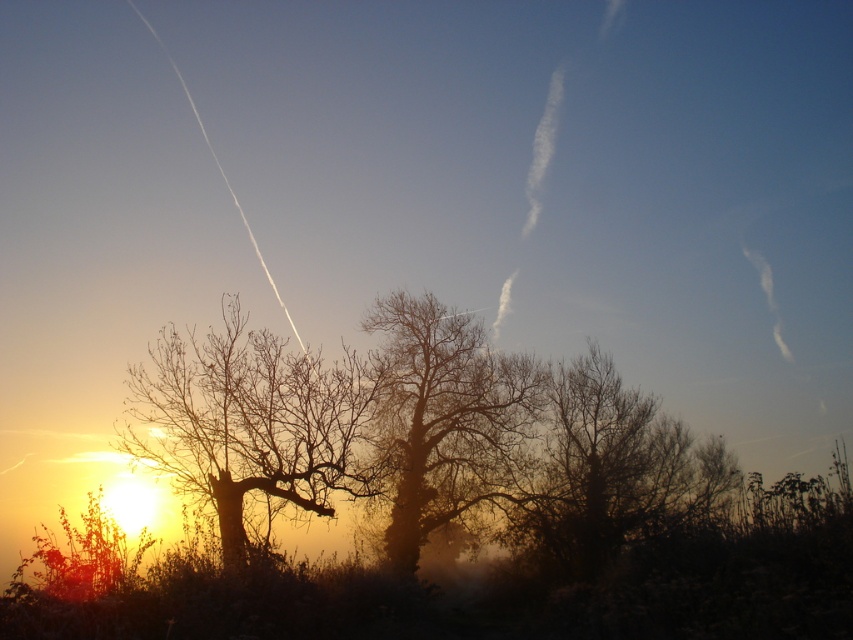
You are an artist trying to paint the sunset scene. You want to place two dots on your canvas at the exact locations of point (505, 456) and point (555, 506). If you are standing in front of the scene, which point will appear closer to you?

Point (505, 456) is further to the viewer than point (555, 506), so the point (505, 456) will appear closer to you.

You are standing in the sunset scene and want to take a photo of the bare wood tree at center. Where should you position yourself to capture the tree in the center of your camera frame?

To capture the bare wood tree at center in the center of your camera frame, position yourself directly facing the tree, aligning your camera with its 2D location at point (445,417).

You are an artist sketching the sunset scene. You want to draw the trees accurately. Which tree should you depict as shorter between the silhouette bare tree at left and the brown textured tree at center?

The silhouette bare tree at left is shorter than the brown textured tree at center, so you should depict the silhouette bare tree at left as shorter.